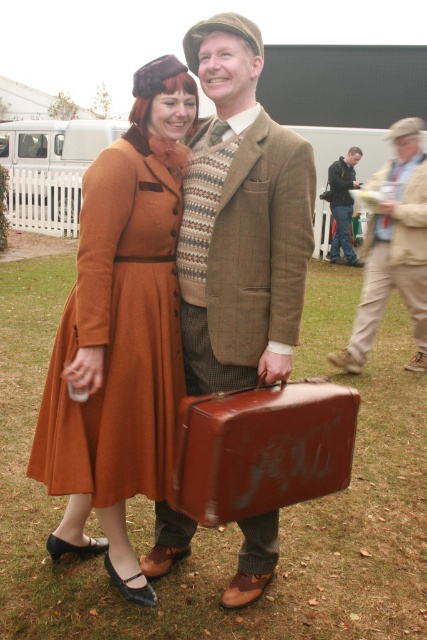
Looking at this image, you are a photographer planning to take a group photo of the matte brown suitcase at center and the beige woolen suit at center. The minimum distance required for your camera to focus clearly is 3 meters. Will you be able to capture both subjects in focus at their current positions?

The matte brown suitcase at center and beige woolen suit at center are 3.18 meters apart, which is slightly more than the 3 meter minimum distance required for clear focus. Therefore, the photographer can capture both subjects in focus at their current positions.

You are standing in front of the two people in the image. You want to throw a small ball to the person holding the red suitcase with a worn texture. Which of the two points, point (243, 417) or point (339, 216), is closer to the person holding the red suitcase?

Point (243, 417) is closer to the camera than point (339, 216). Since the person holding the red suitcase is on the right, the closer point to them would depend on their position. However, based on the given coordinates and depth information, point (243, 417) is closer to the camera, so it is likely closer to the person on the right.

You are a photographer setting up a shoot in this scene. You want to ensure that both the matte brown suitcase at center and the beige woolen suit at center are visible in your composition. Based on their positions, which one should you focus on first to avoid them being blocked by the other?

The matte brown suitcase at center is below the beige woolen suit at center, so you should focus on the beige woolen suit at center first to avoid it blocking the suitcase.